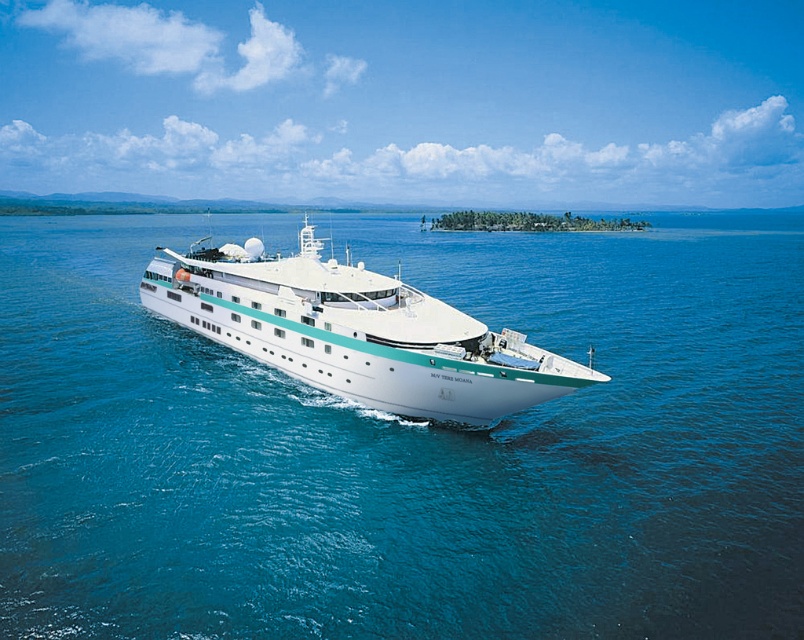
Who is positioned more to the left, blue water at center or white glossy cruise ship at center?

blue water at center

Is blue water at center bigger than white glossy cruise ship at center?

Yes.

Is point (191, 563) less distant than point (498, 404)?

Yes, point (191, 563) is in front of point (498, 404).

Locate an element on the screen. This screenshot has height=640, width=804. blue water at center is located at coordinates (408, 448).